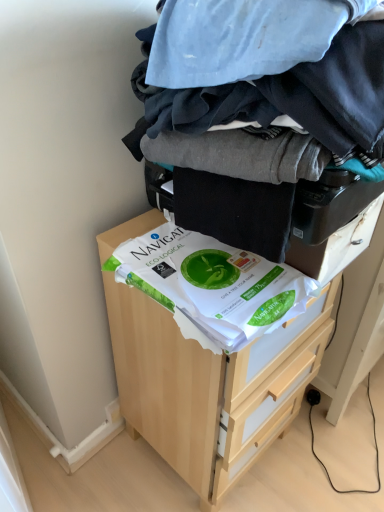
At what (x,y) coordinates should I click in order to perform the action: click on blank space situated above white paper at center (from a real-world perspective). Please return your answer as a coordinate pair (x, y). Image resolution: width=384 pixels, height=512 pixels. Looking at the image, I should click on (205, 268).